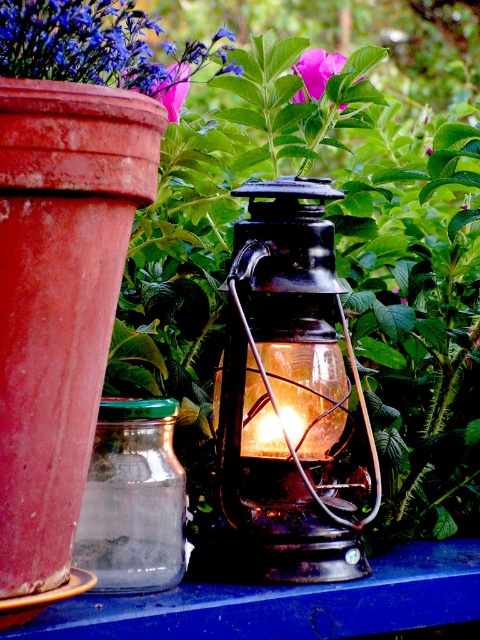
You are setting up a small table in the center of the scene. The table is 1.2 meters wide. Can both the transparent glass lantern at center and the pink matte flower at center fit on the table without overlapping?

The transparent glass lantern at center might be wider than the pink matte flower at center. Since the table is 1.2 meters wide, it depends on their combined widths. If the lantern is wider, their total width must be less than or equal to 1.2 meters to fit without overlapping. However, without exact measurements, we cannot confirm for certain.

You are a photographer aiming to capture the purple matte flower at upper left and the matte black lantern at center in a single frame. Based on their positions, which object should you adjust your camera to focus on first if you want to ensure both are in the shot without moving the camera?

The purple matte flower at upper left should be focused on first because the matte black lantern at center is positioned to the right of it, so adjusting focus starting from the flower ensures the lantern remains within the frame.

You are standing in the rustic outdoor setting and want to place a new decorative item exactly where the transparent glass lantern at center is currently located. What are the coordinates of the spot where you should place your new item?

The coordinates for the transparent glass lantern at center are at point [308,392].